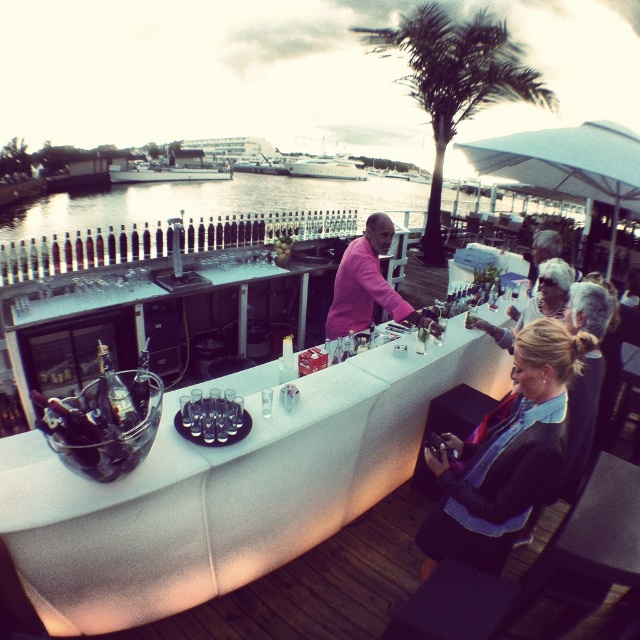
You are a customer standing at the bar and want to order a drink. You notice the white textured bar at center and the denim jacket at lower right. Which object is closer to your right side?

The denim jacket at lower right is closer to your right side because it is positioned to the right of the white textured bar at center.

You are a customer at the bar and want to grab a drink. You notice two points marked on the bar counter. Which point is closer to you, point at coordinate (x=324, y=612) or point at coordinate (x=456, y=90)?

Point at coordinate (x=324, y=612) is closer to you than point at coordinate (x=456, y=90).